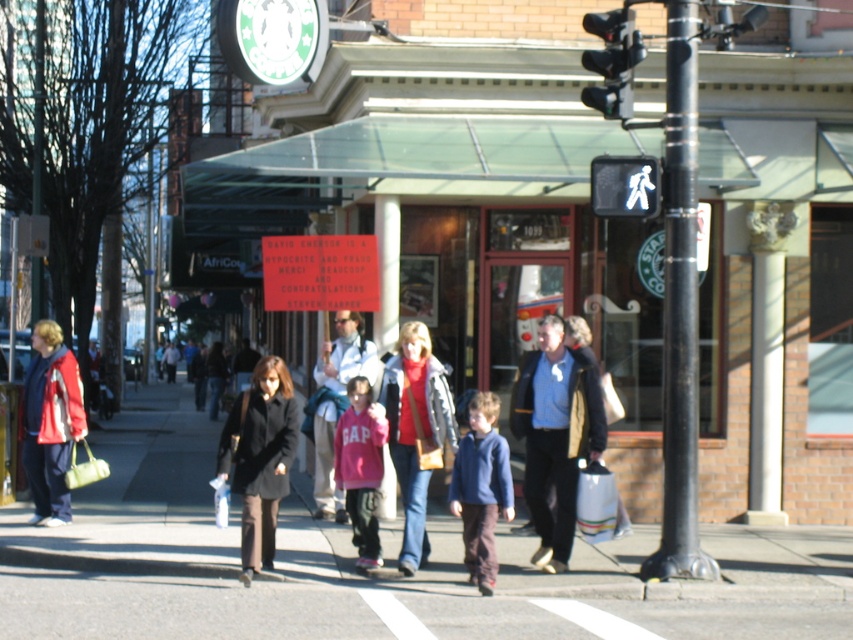
You are a photographer standing at the crosswalk and want to take a photo of both the blue denim jacket at center and the dark brown wool coat at center. However, you need to ensure that neither of them is blocking the other in the shot. Which person should you move forward so that both are visible clearly?

The dark brown wool coat at center is behind the blue denim jacket at center. To ensure both are visible, the person wearing the dark brown wool coat at center should move forward so they are no longer blocked by the blue denim jacket at center.

Based on the photo, you are a tailor observing two jackets in the scene. The blue denim jacket at center and the pink fleece jacket at center. Which one is taller?

The blue denim jacket at center is taller than the pink fleece jacket at center.